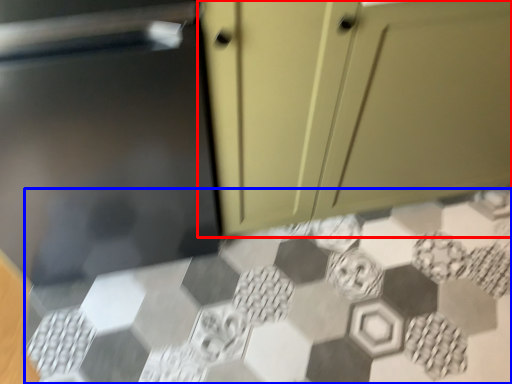
Question: Which point is closer to the camera, cabinetry (highlighted by a red box) or ceramic tile (highlighted by a blue box)?

Choices:
 (A) cabinetry
 (B) ceramic tile

Answer: (A)